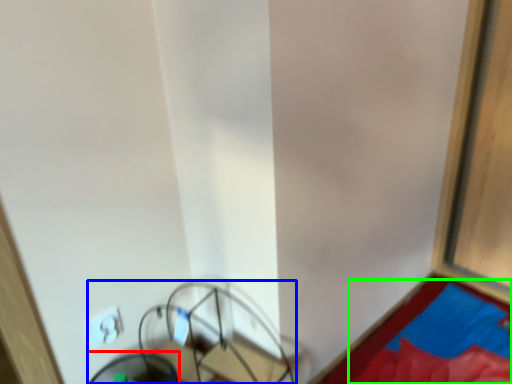
Question: Estimate the real-world distances between objects in this image. Which object is farther from swivel chair (highlighted by a red box), furniture (highlighted by a blue box) or sheet (highlighted by a green box)?

Choices:
 (A) furniture
 (B) sheet

Answer: (B)